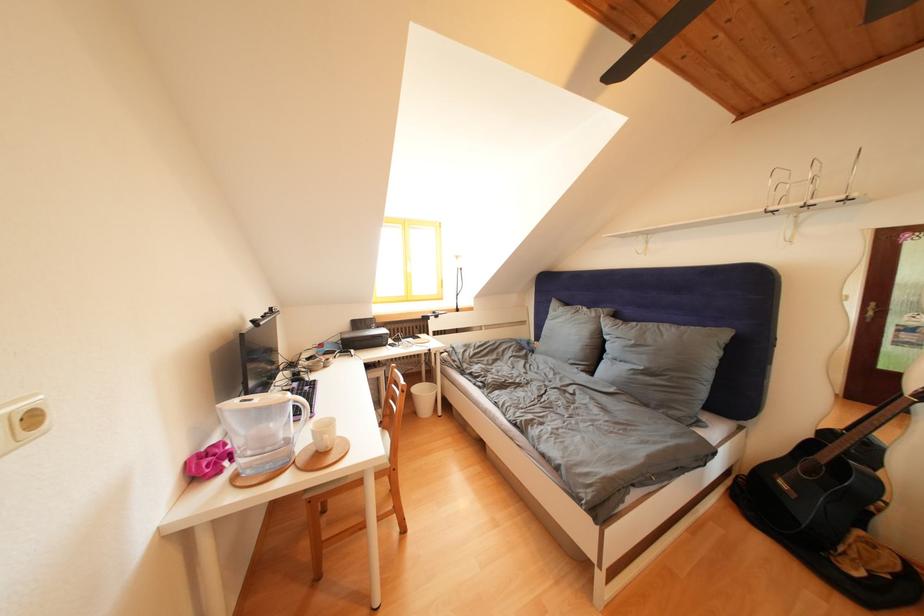
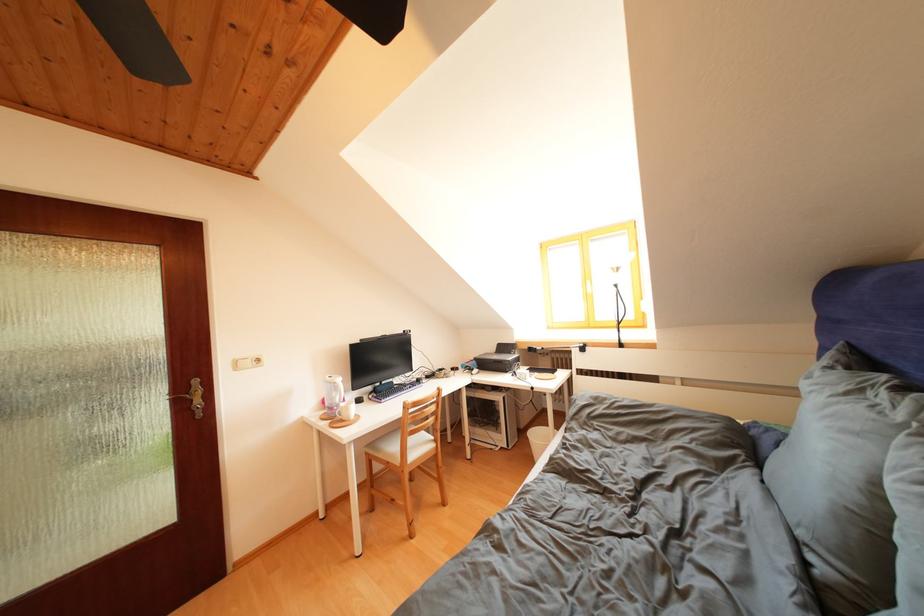
The point at (378,333) is marked in the first image. Where is the corresponding point in the second image?

(517, 358)